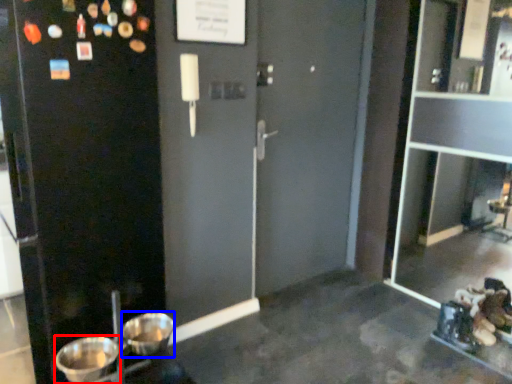
Question: Which of the following is the closest to the observer, basin (highlighted by a red box) or basin (highlighted by a blue box)?

Choices:
 (A) basin
 (B) basin

Answer: (A)